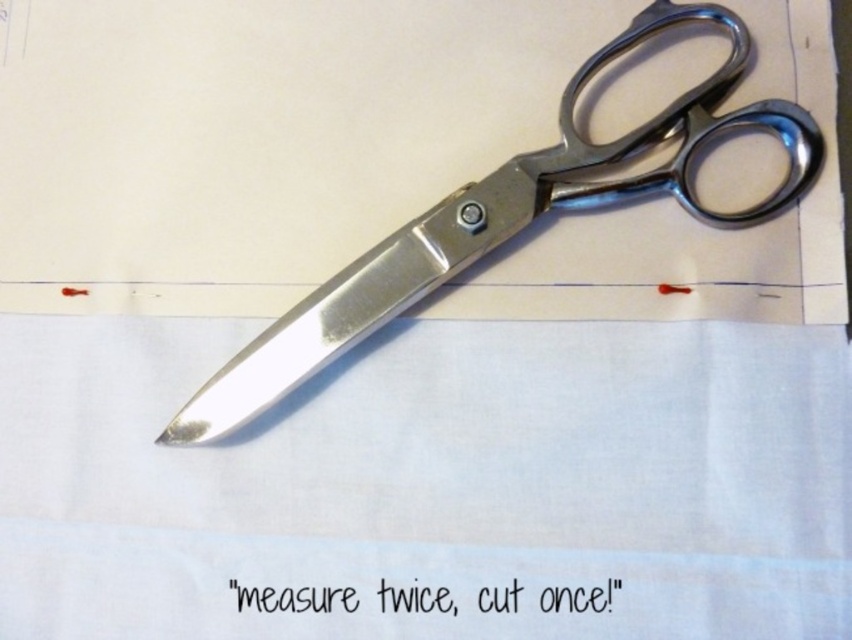
You need to determine if the white fabric at center can fully cover the polished metal scissors at center. Based on their sizes, what do you think?

The white fabric at center is shorter than the polished metal scissors at center, so it cannot fully cover the scissors.

You need to place a small sticker exactly where the white fabric at center and the polished metal scissors at center overlap. Is the sticker more likely to be on the fabric or the scissors?

The white fabric at center is larger in size than the polished metal scissors at center, so the sticker would be more likely to be on the fabric.